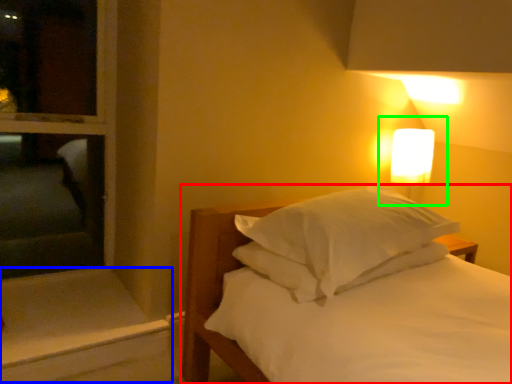
Question: Based on their relative distances, which object is nearer to bed (highlighted by a red box)? Choose from window sill (highlighted by a blue box) and bedside lamp (highlighted by a green box).

Choices:
 (A) window sill
 (B) bedside lamp

Answer: (A)